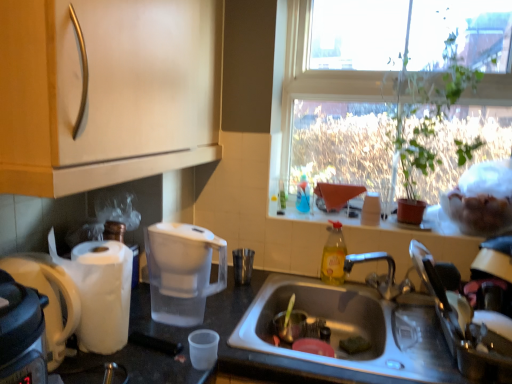
Question: Considering the relative sizes of yellow translucent bottle at sink, the 2th bottle in the left-to-right sequence, and green leafy plant at upper right in the image provided, is yellow translucent bottle at sink, the 2th bottle in the left-to-right sequence, shorter than green leafy plant at upper right?

Choices:
 (A) no
 (B) yes

Answer: (B)

Question: From the image's perspective, is yellow translucent bottle at sink, positioned as the first bottle in right-to-left order, above green leafy plant at upper right?

Choices:
 (A) yes
 (B) no

Answer: (B)

Question: Is yellow translucent bottle at sink, positioned as the first bottle in right-to-left order, at the right side of green leafy plant at upper right?

Choices:
 (A) no
 (B) yes

Answer: (A)

Question: Considering the relative sizes of yellow translucent bottle at sink, which is counted as the 2th bottle, starting from the top, and green leafy plant at upper right in the image provided, is yellow translucent bottle at sink, which is counted as the 2th bottle, starting from the top, bigger than green leafy plant at upper right?

Choices:
 (A) yes
 (B) no

Answer: (B)

Question: Is yellow translucent bottle at sink, which is counted as the 2th bottle, starting from the top, in front of green leafy plant at upper right?

Choices:
 (A) no
 (B) yes

Answer: (A)

Question: Is yellow translucent bottle at sink, which is counted as the 2th bottle, starting from the top, beside green leafy plant at upper right?

Choices:
 (A) no
 (B) yes

Answer: (A)

Question: Is matte wood cabinet at upper left in contact with transparent glass window at upper right?

Choices:
 (A) no
 (B) yes

Answer: (A)

Question: Would you consider matte wood cabinet at upper left to be distant from transparent glass window at upper right?

Choices:
 (A) yes
 (B) no

Answer: (B)

Question: Does matte wood cabinet at upper left appear on the left side of transparent glass window at upper right?

Choices:
 (A) no
 (B) yes

Answer: (B)

Question: From the image's perspective, would you say matte wood cabinet at upper left is positioned over transparent glass window at upper right?

Choices:
 (A) no
 (B) yes

Answer: (B)

Question: From the image's perspective, is matte wood cabinet at upper left located beneath transparent glass window at upper right?

Choices:
 (A) yes
 (B) no

Answer: (B)

Question: Considering the relative sizes of matte wood cabinet at upper left and transparent glass window at upper right in the image provided, is matte wood cabinet at upper left taller than transparent glass window at upper right?

Choices:
 (A) no
 (B) yes

Answer: (A)

Question: Does green leafy plant at upper right have a larger size compared to transparent glass window at upper right?

Choices:
 (A) yes
 (B) no

Answer: (A)